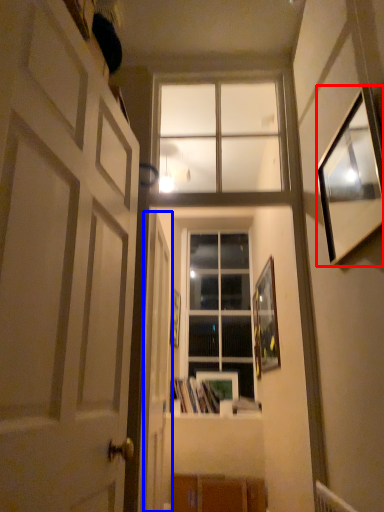
Question: Which object is further to the camera taking this photo, picture frame (highlighted by a red box) or door (highlighted by a blue box)?

Choices:
 (A) picture frame
 (B) door

Answer: (B)